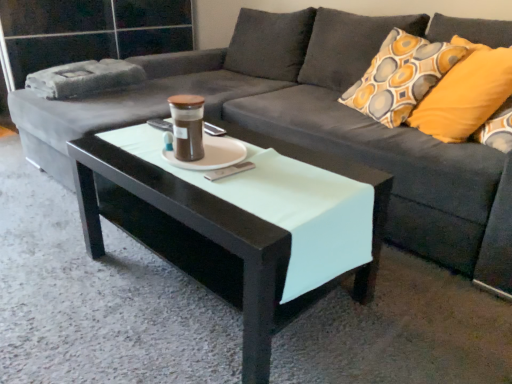
The height and width of the screenshot is (384, 512). In order to click on blank space above black glossy coffee table at center (from a real-world perspective) in this screenshot , I will do `click(225, 164)`.